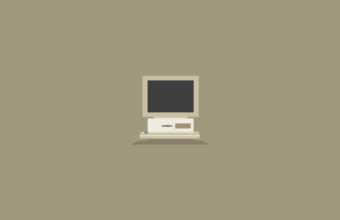
You are a GUI agent. You are given a task and a screenshot of the screen. Output one action in this format:
    pyautogui.click(x=<x>, y=<y>)
    Task: Click on the keyboard
    
    Given the screenshot: What is the action you would take?
    pyautogui.click(x=172, y=133)